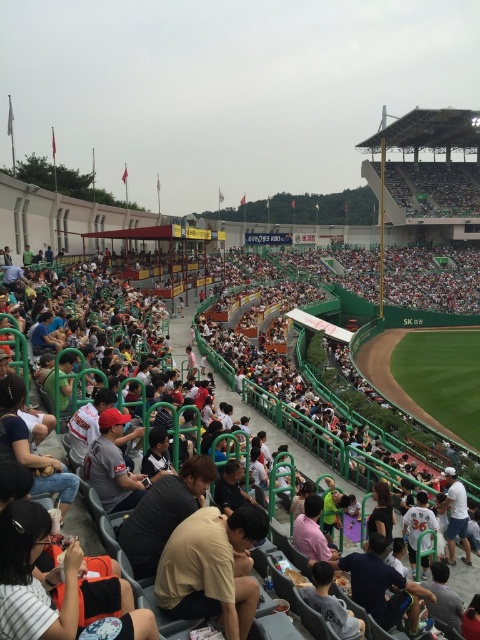
Between green plastic seats at center and light brown cotton shirt at center, which one has more height?

Standing taller between the two is green plastic seats at center.

Measure the distance between point (x=396, y=497) and camera.

They are 40.75 meters apart.

Between point (406, 458) and point (201, 525), which one is positioned in front?

Point (201, 525)

Where is `green plastic seats at center`? green plastic seats at center is located at coordinates (330, 417).